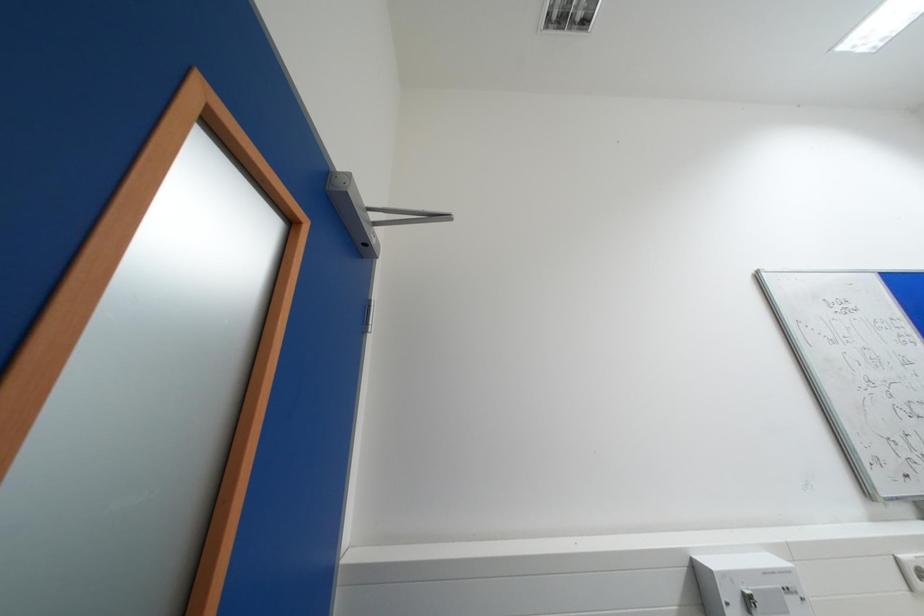
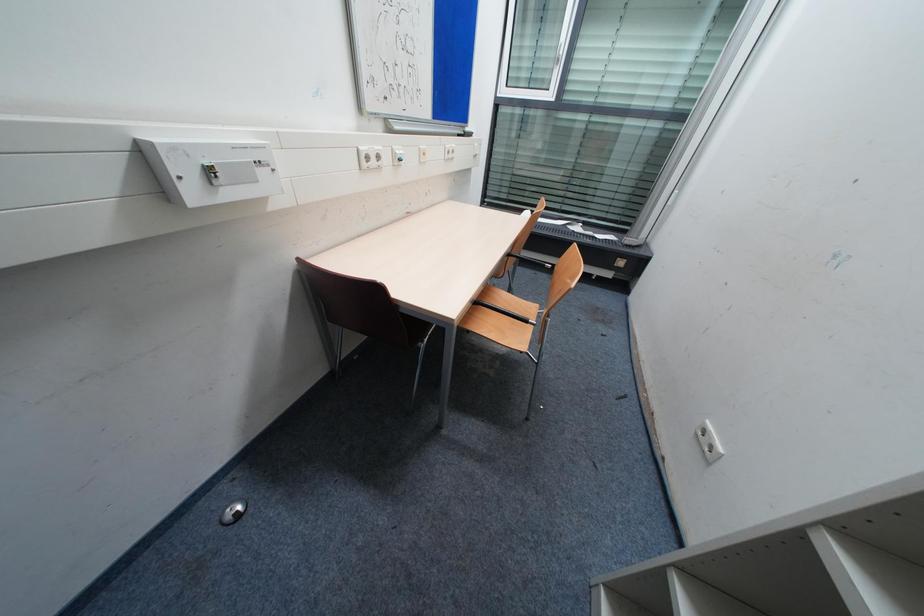
The images are taken continuously from a first-person perspective. In which direction is your viewpoint rotating?

The camera rotated toward right-down.